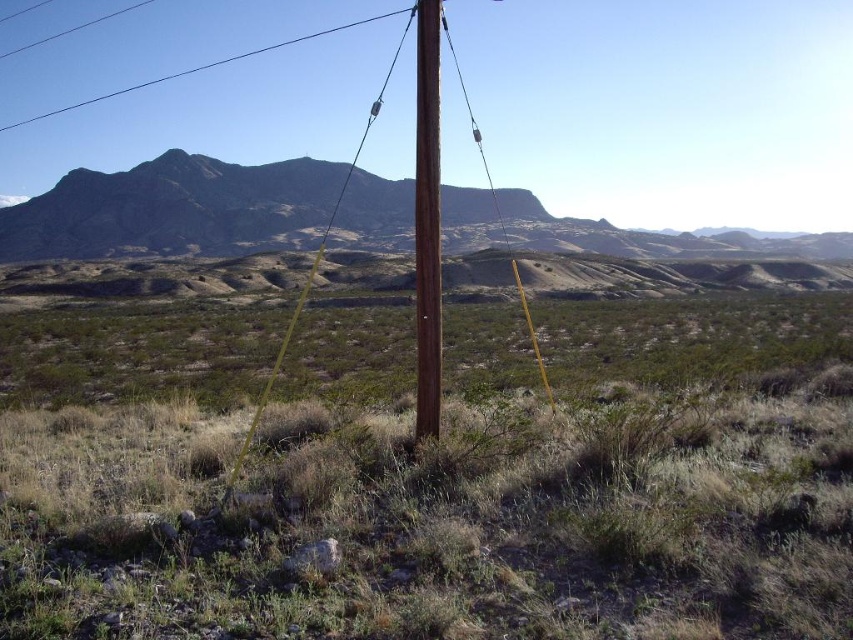
Is point (401, 458) closer to viewer compared to point (418, 64)?

Yes, point (401, 458) is closer to viewer.

Can you confirm if green grass at center is thinner than brown wood pole at center?

In fact, green grass at center might be wider than brown wood pole at center.

Is point (102, 428) closer to camera compared to point (416, 422)?

No, (102, 428) is further to viewer.

Locate an element on the screen. The width and height of the screenshot is (853, 640). green grass at center is located at coordinates (431, 474).

How much distance is there between green grass at center and brown wooden pole at center?

green grass at center is 28.44 meters away from brown wooden pole at center.

Between green grass at center and brown wooden pole at center, which one has less height?

Standing shorter between the two is green grass at center.

This screenshot has height=640, width=853. Describe the element at coordinates (431, 474) in the screenshot. I see `green grass at center` at that location.

Image resolution: width=853 pixels, height=640 pixels. In order to click on green grass at center in this screenshot , I will do `click(431, 474)`.

Based on the photo, can you confirm if brown wooden pole at center is positioned to the left of smooth wire at upper center?

No, brown wooden pole at center is not to the left of smooth wire at upper center.

Is brown wooden pole at center further to the viewer compared to smooth wire at upper center?

No, brown wooden pole at center is in front of smooth wire at upper center.

Between point (354, 152) and point (245, 52), which one is positioned in front?

Point (354, 152) is more forward.

In order to click on brown wooden pole at center in this screenshot , I will do `click(315, 262)`.